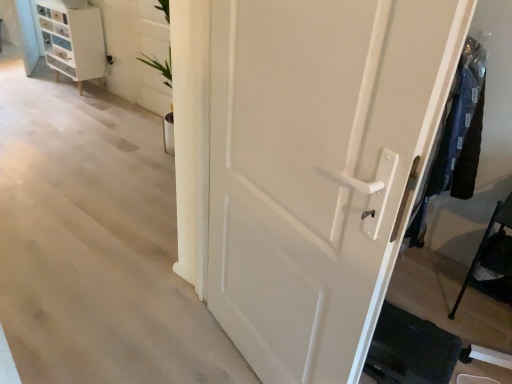
Question: Is white matte door at center positioned with its back to white glossy chest of drawers at upper left?

Choices:
 (A) no
 (B) yes

Answer: (A)

Question: Can you confirm if white matte door at center is wider than white glossy chest of drawers at upper left?

Choices:
 (A) no
 (B) yes

Answer: (A)

Question: Would you say white matte door at center is a long distance from white glossy chest of drawers at upper left?

Choices:
 (A) yes
 (B) no

Answer: (A)

Question: Does white matte door at center have a larger size compared to white glossy chest of drawers at upper left?

Choices:
 (A) no
 (B) yes

Answer: (B)

Question: From a real-world perspective, is white matte door at center over white glossy chest of drawers at upper left?

Choices:
 (A) no
 (B) yes

Answer: (B)

Question: Is dark blue fabric at right bigger or smaller than white glossy chest of drawers at upper left?

Choices:
 (A) small
 (B) big

Answer: (A)

Question: Do you think dark blue fabric at right is within white glossy chest of drawers at upper left, or outside of it?

Choices:
 (A) inside
 (B) outside

Answer: (B)

Question: Is point (442, 155) closer or farther from the camera than point (53, 41)?

Choices:
 (A) farther
 (B) closer

Answer: (B)

Question: From the image's perspective, relative to white glossy chest of drawers at upper left, is dark blue fabric at right above or below?

Choices:
 (A) above
 (B) below

Answer: (B)

Question: Looking at the image, does black metal cane at lower right seem bigger or smaller compared to white glossy chest of drawers at upper left?

Choices:
 (A) big
 (B) small

Answer: (B)

Question: Visually, is black metal cane at lower right positioned to the left or to the right of white glossy chest of drawers at upper left?

Choices:
 (A) right
 (B) left

Answer: (A)

Question: Looking at their shapes, would you say black metal cane at lower right is wider or thinner than white glossy chest of drawers at upper left?

Choices:
 (A) wide
 (B) thin

Answer: (A)

Question: From the image's perspective, is black metal cane at lower right above or below white glossy chest of drawers at upper left?

Choices:
 (A) above
 (B) below

Answer: (B)

Question: Looking at their shapes, would you say white glossy chest of drawers at upper left is wider or thinner than dark blue fabric at right?

Choices:
 (A) thin
 (B) wide

Answer: (A)

Question: From their relative heights in the image, would you say white glossy chest of drawers at upper left is taller or shorter than dark blue fabric at right?

Choices:
 (A) tall
 (B) short

Answer: (B)